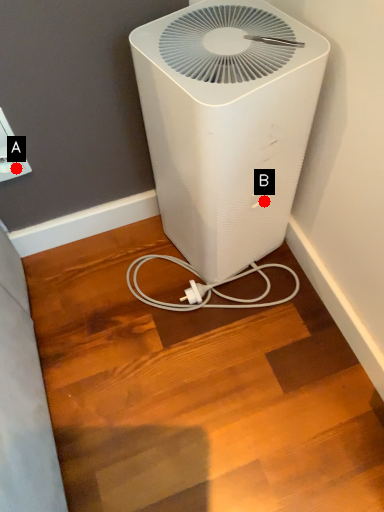
Question: Two points are circled on the image, labeled by A and B beside each circle. Among these points, which one is nearest to the camera?

Choices:
 (A) A is closer
 (B) B is closer

Answer: (B)